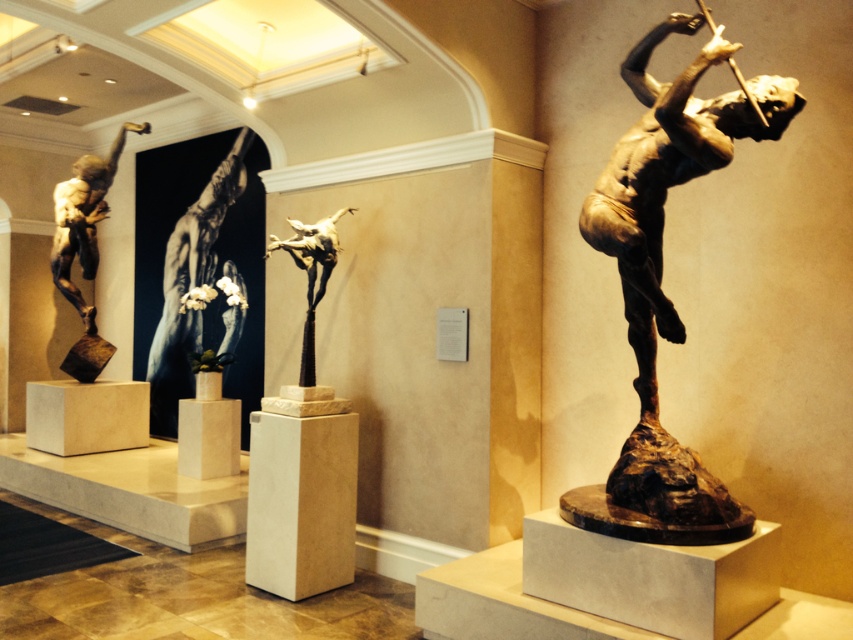
You are an art curator planning to install a new spotlight in the gallery. The spotlight needs to be placed at coordinates point A, which is at position 0.3, 0.8. Will the bronze statue at right block the light from reaching the spotlight if the statue is at point 0.441, 0.775?

The bronze statue at right is located at point (660, 282), which is closer to the spotlight position (682, 192) than the statue. Therefore, the statue will block the light from reaching the spotlight.